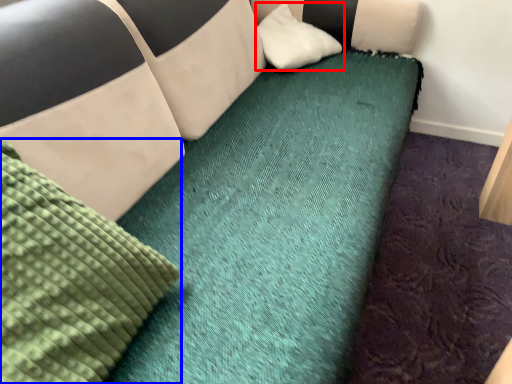
Question: Which object appears farthest to the camera in this image, pillow (highlighted by a red box) or mattress (highlighted by a blue box)?

Choices:
 (A) pillow
 (B) mattress

Answer: (A)